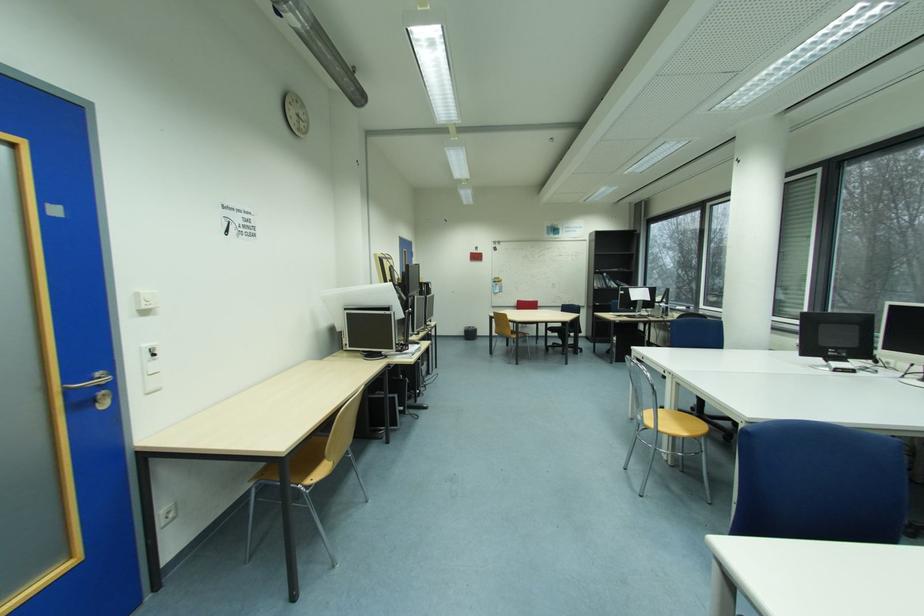
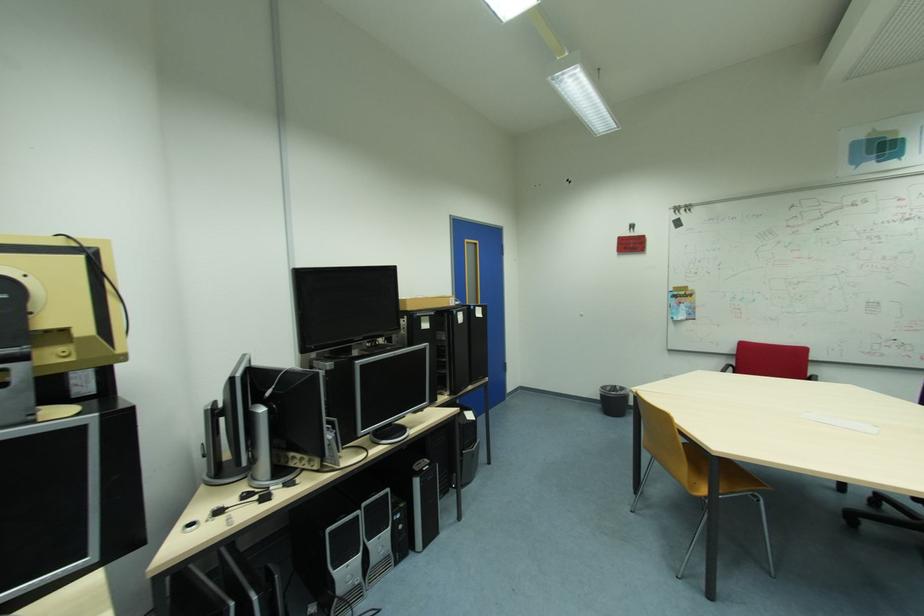
Locate, in the second image, the point that corresponds to point 469,334 in the first image.

(605, 400)